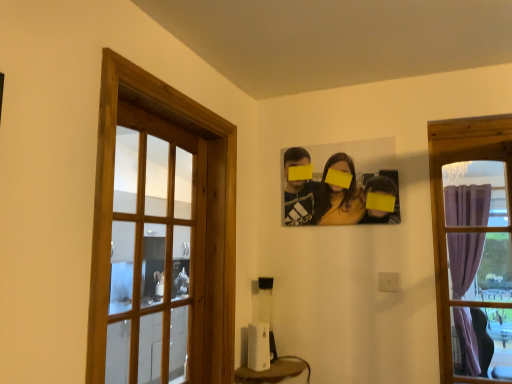
The height and width of the screenshot is (384, 512). Find the location of `wooden frame at left, the 1th window from the left`. wooden frame at left, the 1th window from the left is located at coordinates (208, 188).

Locate an element on the screen. The image size is (512, 384). purple curtain at right, the second window in the left-to-right sequence is located at coordinates (473, 246).

Locate an element on the screen. The width and height of the screenshot is (512, 384). matte black photo frame at upper center is located at coordinates (340, 184).

What is the approximate width of matte black photo frame at upper center?

The width of matte black photo frame at upper center is 5.51 centimeters.

The image size is (512, 384). I want to click on wooden frame at left, the 1th window from the left, so click(208, 188).

Can you confirm if purple curtain at right, the second window in the left-to-right sequence, is bigger than wooden frame at left, the second window in the right-to-left sequence?

Incorrect, purple curtain at right, the second window in the left-to-right sequence, is not larger than wooden frame at left, the second window in the right-to-left sequence.

Is purple curtain at right, placed as the first window when sorted from right to left, inside the boundaries of wooden frame at left, the 1th window from the left, or outside?

purple curtain at right, placed as the first window when sorted from right to left, is outside wooden frame at left, the 1th window from the left.

Considering the positions of objects purple curtain at right, placed as the first window when sorted from right to left, and wooden frame at left, the second window in the right-to-left sequence, in the image provided, who is in front, purple curtain at right, placed as the first window when sorted from right to left, or wooden frame at left, the second window in the right-to-left sequence,?

wooden frame at left, the second window in the right-to-left sequence, is closer to the camera.

Considering the sizes of objects purple curtain at right, placed as the first window when sorted from right to left, and wooden frame at left, the 1th window from the left, in the image provided, who is wider, purple curtain at right, placed as the first window when sorted from right to left, or wooden frame at left, the 1th window from the left,?

With larger width is wooden frame at left, the 1th window from the left.

Is white plastic speaker at lower center wider or thinner than purple curtain at right, placed as the first window when sorted from right to left?

In the image, white plastic speaker at lower center appears to be wider than purple curtain at right, placed as the first window when sorted from right to left.

In the scene shown: What's the angular difference between white plastic speaker at lower center and purple curtain at right, the second window in the left-to-right sequence,'s facing directions?

The facing directions of white plastic speaker at lower center and purple curtain at right, the second window in the left-to-right sequence, are 88.6 degrees apart.

Considering the relative sizes of white plastic speaker at lower center and purple curtain at right, the second window in the left-to-right sequence, in the image provided, is white plastic speaker at lower center smaller than purple curtain at right, the second window in the left-to-right sequence,?

Indeed, white plastic speaker at lower center has a smaller size compared to purple curtain at right, the second window in the left-to-right sequence.

Is point (249, 382) positioned behind point (467, 274)?

No, (249, 382) is closer to viewer.

Is purple curtain at right, placed as the first window when sorted from right to left, smaller than white plastic speaker at lower center?

Incorrect, purple curtain at right, placed as the first window when sorted from right to left, is not smaller in size than white plastic speaker at lower center.

Is the surface of purple curtain at right, placed as the first window when sorted from right to left, in direct contact with white plastic speaker at lower center?

No, purple curtain at right, placed as the first window when sorted from right to left, is not making contact with white plastic speaker at lower center.

Is purple curtain at right, the second window in the left-to-right sequence, surrounding white plastic speaker at lower center?

No, white plastic speaker at lower center is located outside of purple curtain at right, the second window in the left-to-right sequence.

Which object is further away from the camera taking this photo, white plastic speaker at lower center or matte black photo frame at upper center?

matte black photo frame at upper center is further away from the camera.

Which of these two, white plastic speaker at lower center or matte black photo frame at upper center, is smaller?

white plastic speaker at lower center.

Which point is more forward, (x=282, y=370) or (x=322, y=182)?

Point (x=282, y=370)

Is matte black photo frame at upper center at the back of white plastic speaker at lower center?

No, matte black photo frame at upper center is not at the back of white plastic speaker at lower center.

Which is more to the left, wooden frame at left, the second window in the right-to-left sequence, or purple curtain at right, placed as the first window when sorted from right to left?

From the viewer's perspective, wooden frame at left, the second window in the right-to-left sequence, appears more on the left side.

How many degrees apart are the facing directions of wooden frame at left, the second window in the right-to-left sequence, and purple curtain at right, placed as the first window when sorted from right to left?

They differ by 89.1 degrees in their facing directions.

Which of these two, wooden frame at left, the second window in the right-to-left sequence, or purple curtain at right, the second window in the left-to-right sequence, is smaller?

Smaller between the two is purple curtain at right, the second window in the left-to-right sequence.

Does wooden frame at left, the 1th window from the left, come behind purple curtain at right, the second window in the left-to-right sequence?

No, it is not.

Is the position of matte black photo frame at upper center less distant than that of purple curtain at right, placed as the first window when sorted from right to left?

No, matte black photo frame at upper center is further to the viewer.

In the scene shown: Is matte black photo frame at upper center located outside purple curtain at right, the second window in the left-to-right sequence?

matte black photo frame at upper center lies outside purple curtain at right, the second window in the left-to-right sequence,'s area.

Is matte black photo frame at upper center directly adjacent to purple curtain at right, placed as the first window when sorted from right to left?

No, matte black photo frame at upper center is not making contact with purple curtain at right, placed as the first window when sorted from right to left.

How many degrees apart are the facing directions of matte black photo frame at upper center and purple curtain at right, the second window in the left-to-right sequence?

0.449 degrees.

Does matte black photo frame at upper center contain white plastic speaker at lower center?

No, matte black photo frame at upper center does not contain white plastic speaker at lower center.

In the image, there is a matte black photo frame at upper center. At what (x,y) coordinates should I click in order to perform the action: click on furniture below it (from a real-world perspective). Please return your answer as a coordinate pair (x, y). The image size is (512, 384). Looking at the image, I should click on (273, 371).

How different are the orientations of matte black photo frame at upper center and white plastic speaker at lower center in degrees?

They differ by 88.2 degrees in their facing directions.

From a real-world perspective, who is located lower, matte black photo frame at upper center or white plastic speaker at lower center?

white plastic speaker at lower center.

You are a GUI agent. You are given a task and a screenshot of the screen. Output one action in this format:
    pyautogui.click(x=<x>, y=<y>)
    Task: Click on the window located below the wooden frame at left, the 1th window from the left (from the image's perspective)
    
    Given the screenshot: What is the action you would take?
    pyautogui.click(x=473, y=246)

Identify the location of furniture lying behind the purple curtain at right, the second window in the left-to-right sequence. The width and height of the screenshot is (512, 384). (273, 371).

Estimate the real-world distances between objects in this image. Which object is closer to matte black photo frame at upper center, wooden frame at left, the second window in the right-to-left sequence, or white plastic speaker at lower center?

wooden frame at left, the second window in the right-to-left sequence, is positioned closer to the anchor matte black photo frame at upper center.

When comparing their distances from matte black photo frame at upper center, does wooden frame at left, the 1th window from the left, or purple curtain at right, the second window in the left-to-right sequence, seem further?

Based on the image, wooden frame at left, the 1th window from the left, appears to be further to matte black photo frame at upper center.

Which object lies nearer to the anchor point purple curtain at right, placed as the first window when sorted from right to left, white plastic speaker at lower center or wooden frame at left, the second window in the right-to-left sequence?

white plastic speaker at lower center.

Based on their spatial positions, is matte black photo frame at upper center or white plastic speaker at lower center further from purple curtain at right, the second window in the left-to-right sequence?

Based on the image, white plastic speaker at lower center appears to be further to purple curtain at right, the second window in the left-to-right sequence.

Considering their positions, is purple curtain at right, placed as the first window when sorted from right to left, positioned further to wooden frame at left, the 1th window from the left, than white plastic speaker at lower center?

purple curtain at right, placed as the first window when sorted from right to left, is further to wooden frame at left, the 1th window from the left.

Based on their spatial positions, is white plastic speaker at lower center or matte black photo frame at upper center further from wooden frame at left, the second window in the right-to-left sequence?

Among the two, white plastic speaker at lower center is located further to wooden frame at left, the second window in the right-to-left sequence.

When comparing their distances from purple curtain at right, placed as the first window when sorted from right to left, does matte black photo frame at upper center or wooden frame at left, the 1th window from the left, seem further?

The object further to purple curtain at right, placed as the first window when sorted from right to left, is wooden frame at left, the 1th window from the left.

Looking at the image, which one is located further to wooden frame at left, the 1th window from the left, matte black photo frame at upper center or white plastic speaker at lower center?

white plastic speaker at lower center lies further to wooden frame at left, the 1th window from the left, than the other object.

Identify the location of furniture between wooden frame at left, the second window in the right-to-left sequence, and purple curtain at right, placed as the first window when sorted from right to left. (273, 371).

Identify the location of couple situated between wooden frame at left, the 1th window from the left, and purple curtain at right, placed as the first window when sorted from right to left, from left to right. The width and height of the screenshot is (512, 384). (340, 184).